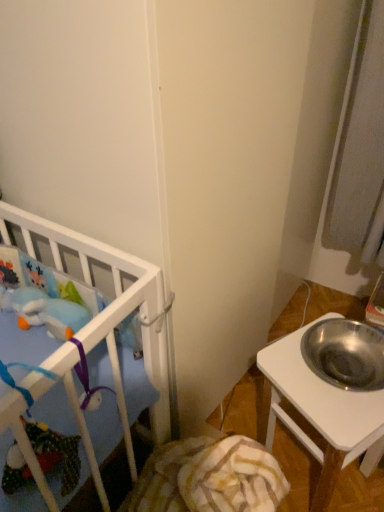
You are a GUI agent. You are given a task and a screenshot of the screen. Output one action in this format:
    pyautogui.click(x=<x>, y=<y>)
    Task: Click on the metallic silver bowl at right
    The height and width of the screenshot is (512, 384).
    Given the screenshot: What is the action you would take?
    pyautogui.click(x=322, y=413)

The image size is (384, 512). What do you see at coordinates (322, 413) in the screenshot?
I see `metallic silver bowl at right` at bounding box center [322, 413].

Locate an element on the screen. metallic silver bowl at right is located at coordinates (322, 413).